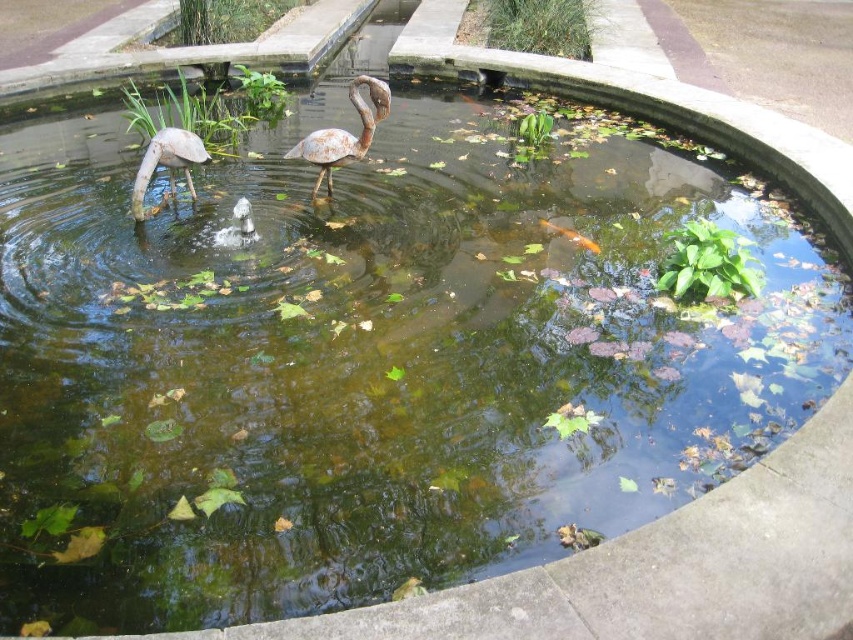
You are standing at the edge of the pond and want to place a new decorative item exactly at the location of the rusty metal flamingo at center. What are the coordinates where you should place it?

The coordinates for the rusty metal flamingo at center are at point (344, 132).

You are a maintenance worker tasked with cleaning the pond. You need to retrieve the rusty metal flamingo at center and the matte white flamingo at left. Which flamingo should you reach for first based on their positions?

You should reach for the rusty metal flamingo at center first because it is closer to you than the matte white flamingo at left, which is further away.

You are a maintenance worker tasked with removing the rusty metal flamingo at center and the matte white flamingo at left from the pond. Based on their positions, which flamingo should you retrieve first to avoid disturbing the other?

You should retrieve the rusty metal flamingo at center first because it is located above the matte white flamingo at left, meaning it is closer to the surface and easier to access without disturbing the lower one.